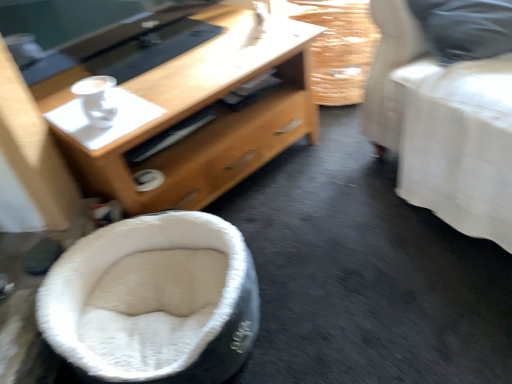
Locate an element on the screen. Image resolution: width=512 pixels, height=384 pixels. free point above wooden desk at center (from a real-world perspective) is located at coordinates (174, 61).